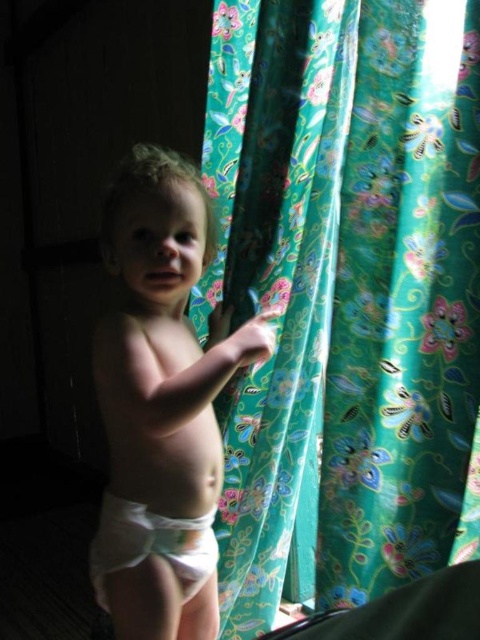
Question: Which object appears farthest from the camera in this image?

Choices:
 (A) green floral fabric at center
 (B) white cloth diaper at center

Answer: (A)

Question: Does white cloth diaper at center have a larger size compared to white cloth diaper at lower center?

Choices:
 (A) yes
 (B) no

Answer: (A)

Question: In this image, where is green floral fabric at center located relative to white cloth diaper at center?

Choices:
 (A) right
 (B) left

Answer: (A)

Question: Can you confirm if green floral fabric at center is positioned to the left of white cloth diaper at lower center?

Choices:
 (A) no
 (B) yes

Answer: (A)

Question: Among these points, which one is farthest from the camera?

Choices:
 (A) (156, 516)
 (B) (296, 554)

Answer: (B)

Question: Among these points, which one is farthest from the camera?

Choices:
 (A) (154, 552)
 (B) (229, 401)

Answer: (B)